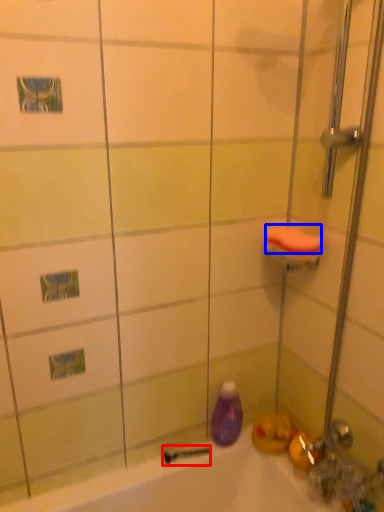
Question: Which point is closer to the camera, shower (highlighted by a red box) or soap (highlighted by a blue box)?

Choices:
 (A) shower
 (B) soap

Answer: (B)